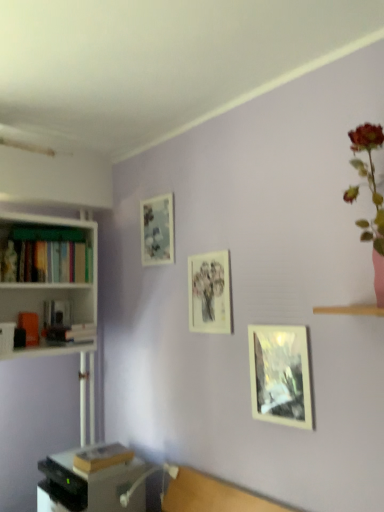
Question: Based on their positions, is hardcover book at lower left, the 1th book in the bottom-to-top sequence, located to the left or right of hardcover book at left, acting as the second book starting from the bottom?

Choices:
 (A) left
 (B) right

Answer: (B)

Question: Is hardcover book at lower left, the 1th book in the bottom-to-top sequence, inside the boundaries of hardcover book at left, acting as the 2th book starting from the top, or outside?

Choices:
 (A) inside
 (B) outside

Answer: (B)

Question: Which is nearer to the hardcover book at lower left, the 3th book positioned from the top?

Choices:
 (A) matte glass picture frame at upper left, which ranks as the third picture frame in right-to-left order
 (B) white matte bookshelf at left
 (C) hardcover book at left, acting as the 2th book starting from the top
 (D) hardcover books at left, positioned as the third book in bottom-to-top order
 (E) matte paper picture frame at center, marked as the 2th picture frame in a back-to-front arrangement

Answer: (C)

Question: Considering the real-world distances, which object is farthest from the white matte bookshelf at left?

Choices:
 (A) matte glass picture frame at center-right, which is counted as the 3th picture frame, starting from the left
 (B) hardcover books at left, acting as the 1th book starting from the top
 (C) matte glass picture frame at upper left, positioned as the 1th picture frame in top-to-bottom order
 (D) hardcover book at lower left, the 1th book in the bottom-to-top sequence
 (E) matte paper picture frame at center, the 2th picture frame viewed from the front

Answer: (A)